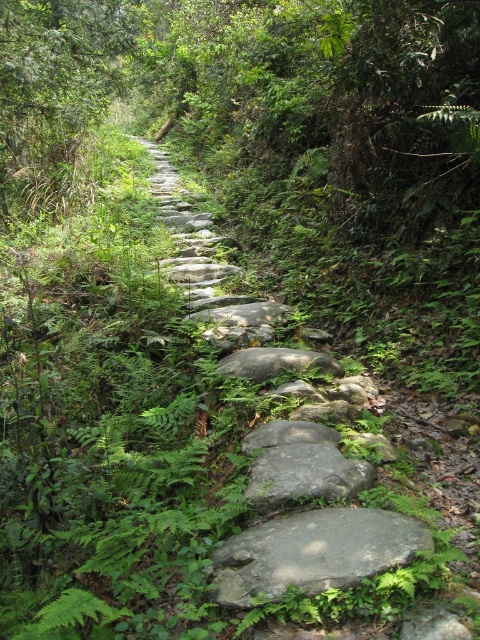
Question: Does gray/rough stone at center lie behind gray rough stone at center?

Choices:
 (A) yes
 (B) no

Answer: (B)

Question: Is gray/rough stone at center smaller than gray smooth rock at center?

Choices:
 (A) no
 (B) yes

Answer: (B)

Question: Can you confirm if gray/rough stone at center is bigger than gray smooth rock at center?

Choices:
 (A) no
 (B) yes

Answer: (A)

Question: Which object is positioned farthest from the gray smooth stone at center?

Choices:
 (A) gray/rough stone at center
 (B) gray rough stone at center

Answer: (A)

Question: Which is nearer to the gray/rough stone at center?

Choices:
 (A) gray smooth rock at center
 (B) gray rough stone at center
 (C) gray smooth stone at center

Answer: (B)

Question: Which is nearer to the gray rough stone at center?

Choices:
 (A) gray smooth stone at center
 (B) gray smooth rock at center
 (C) gray/rough stone at center

Answer: (A)